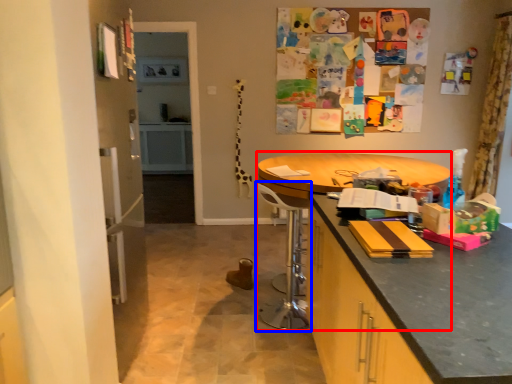
Question: Which point is further to the camera, round table (highlighted by a red box) or swivel chair (highlighted by a blue box)?

Choices:
 (A) round table
 (B) swivel chair

Answer: (B)